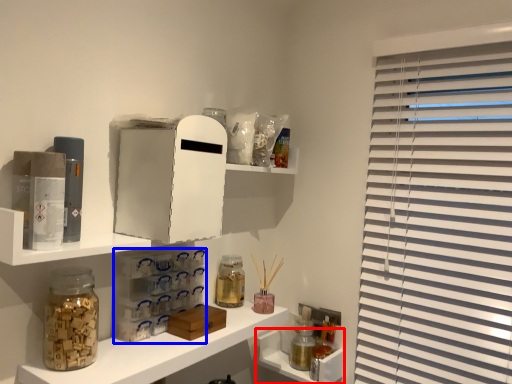
Question: Which object is further to the camera taking this photo, cabinet (highlighted by a red box) or cabinet (highlighted by a blue box)?

Choices:
 (A) cabinet
 (B) cabinet

Answer: (A)